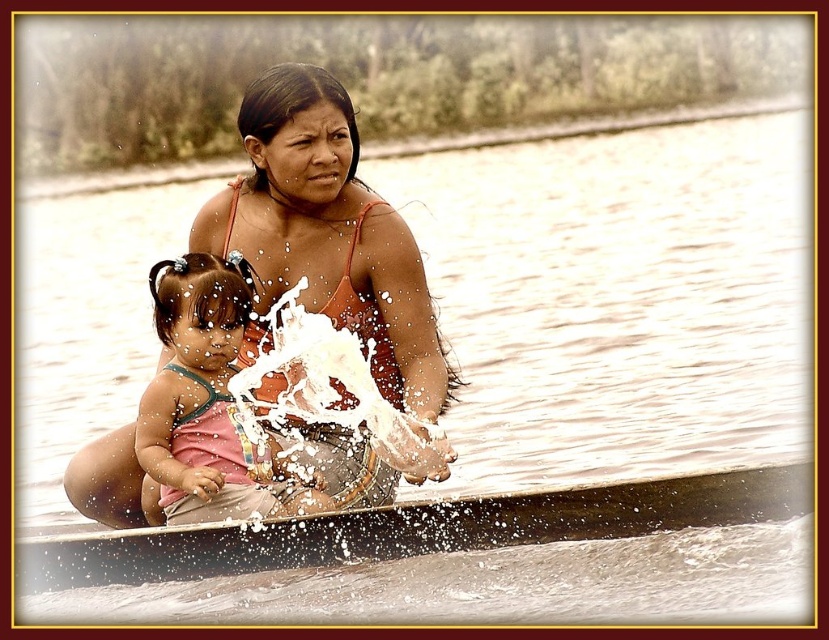
Question: Which point is farther to the camera?

Choices:
 (A) matte orange tank top at center
 (B) wooden canoe at center

Answer: (A)

Question: Can you confirm if wooden canoe at center is positioned to the left of pink fabric dress at center?

Choices:
 (A) no
 (B) yes

Answer: (A)

Question: Which point is farther from the camera taking this photo?

Choices:
 (A) (197, 218)
 (B) (304, 554)

Answer: (A)

Question: Is matte orange tank top at center in front of pink fabric dress at center?

Choices:
 (A) yes
 (B) no

Answer: (A)

Question: Which object is closer to the camera taking this photo?

Choices:
 (A) matte orange tank top at center
 (B) pink fabric dress at center
 (C) wooden canoe at center

Answer: (C)

Question: Is wooden canoe at center to the right of pink fabric dress at center from the viewer's perspective?

Choices:
 (A) no
 (B) yes

Answer: (B)